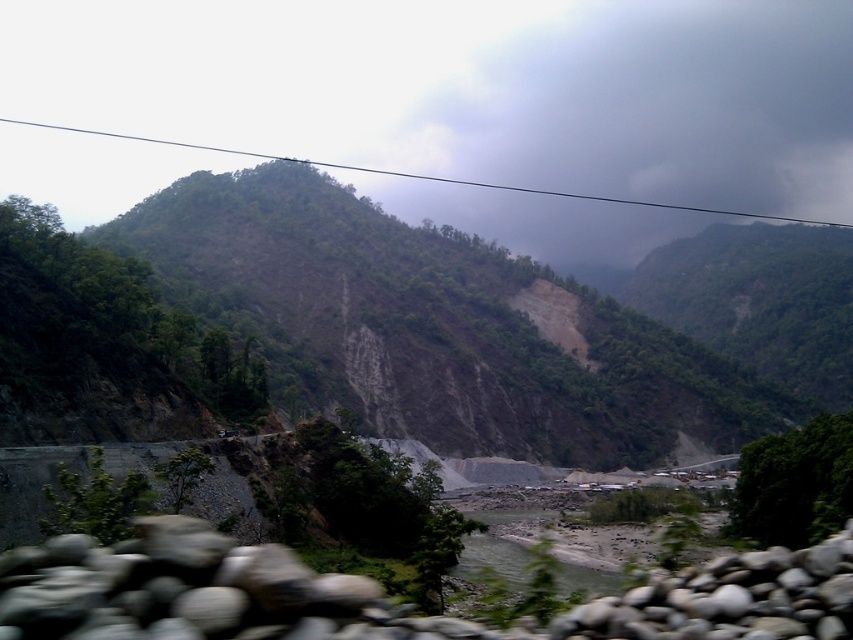
How much distance is there between dark gray cloud at upper center and brown sandy river at center?

The distance of dark gray cloud at upper center from brown sandy river at center is 523.36 meters.

Which is in front, point (614, 218) or point (595, 588)?

Point (595, 588) is in front.

Which is in front, point (659, 97) or point (496, 554)?

Point (496, 554)

The width and height of the screenshot is (853, 640). What are the coordinates of `dark gray cloud at upper center` in the screenshot? It's located at (616, 99).

Does dark gray cloud at upper center appear on the right side of gray smooth stones at lower right?

Indeed, dark gray cloud at upper center is positioned on the right side of gray smooth stones at lower right.

Is dark gray cloud at upper center wider than gray smooth stones at lower right?

Yes, dark gray cloud at upper center is wider than gray smooth stones at lower right.

The height and width of the screenshot is (640, 853). Describe the element at coordinates (616, 99) in the screenshot. I see `dark gray cloud at upper center` at that location.

Locate an element on the screen. The image size is (853, 640). dark gray cloud at upper center is located at coordinates (616, 99).

Is point (775, 548) closer to camera compared to point (502, 545)?

Yes.

Locate an element on the screen. gray smooth stones at lower right is located at coordinates (730, 598).

Locate an element on the screen. gray smooth stones at lower right is located at coordinates (730, 598).

Find the location of `gray smooth stones at lower right`. gray smooth stones at lower right is located at coordinates (730, 598).